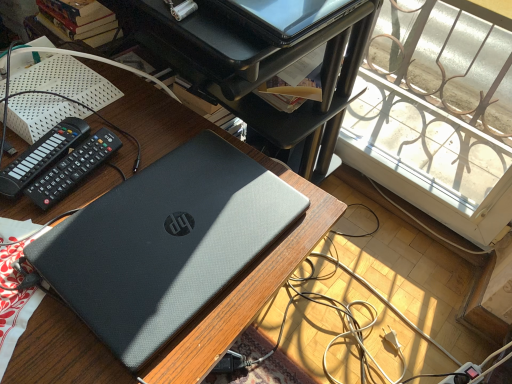
Question: Is sleek black laptop at upper center completely or partially inside black plastic remote at left, which ranks as the 2th control in right-to-left order?

Choices:
 (A) no
 (B) yes

Answer: (A)

Question: Considering the relative sizes of black plastic remote at left, which appears as the 1th control when viewed from the left, and sleek black laptop at upper center in the image provided, is black plastic remote at left, which appears as the 1th control when viewed from the left, smaller than sleek black laptop at upper center?

Choices:
 (A) no
 (B) yes

Answer: (B)

Question: Can you confirm if black plastic remote at left, which appears as the 1th control when viewed from the left, is bigger than sleek black laptop at upper center?

Choices:
 (A) no
 (B) yes

Answer: (A)

Question: Is black plastic remote at left, which appears as the 1th control when viewed from the left, positioned far away from sleek black laptop at upper center?

Choices:
 (A) yes
 (B) no

Answer: (B)

Question: Is black plastic remote at left, which ranks as the 2th control in right-to-left order, to the left of sleek black laptop at upper center from the viewer's perspective?

Choices:
 (A) no
 (B) yes

Answer: (B)

Question: Is black plastic remote at left, which ranks as the 2th control in right-to-left order, wider or thinner than sleek black laptop at upper center?

Choices:
 (A) wide
 (B) thin

Answer: (B)

Question: Which is correct: black plastic remote at left, which appears as the 1th control when viewed from the left, is inside sleek black laptop at upper center, or outside of it?

Choices:
 (A) outside
 (B) inside

Answer: (A)

Question: In terms of height, does black plastic remote at left, which appears as the 1th control when viewed from the left, look taller or shorter compared to sleek black laptop at upper center?

Choices:
 (A) tall
 (B) short

Answer: (B)

Question: From the image's perspective, is black plastic remote at left, which ranks as the 2th control in right-to-left order, above or below sleek black laptop at upper center?

Choices:
 (A) below
 (B) above

Answer: (A)

Question: From a real-world perspective, relative to black plastic remote at left, which ranks as the 2th control in right-to-left order, is sleek black laptop at upper center vertically above or below?

Choices:
 (A) above
 (B) below

Answer: (A)

Question: In the image, is sleek black laptop at upper center on the left side or the right side of black plastic remote at left, which appears as the 1th control when viewed from the left?

Choices:
 (A) right
 (B) left

Answer: (A)

Question: In terms of width, does sleek black laptop at upper center look wider or thinner when compared to black plastic remote at left, which appears as the 1th control when viewed from the left?

Choices:
 (A) thin
 (B) wide

Answer: (B)

Question: Considering the positions of sleek black laptop at upper center and black plastic remote at left, which appears as the 1th control when viewed from the left, in the image, is sleek black laptop at upper center bigger or smaller than black plastic remote at left, which appears as the 1th control when viewed from the left,?

Choices:
 (A) small
 (B) big

Answer: (B)

Question: From the image's perspective, is black plastic remote at left, which appears as the 1th control when viewed from the left, above or below black plastic remote at upper left, which is counted as the 1th control, starting from the right?

Choices:
 (A) below
 (B) above

Answer: (B)

Question: Looking at their shapes, would you say black plastic remote at left, which ranks as the 2th control in right-to-left order, is wider or thinner than black plastic remote at upper left, which is counted as the 1th control, starting from the right?

Choices:
 (A) wide
 (B) thin

Answer: (A)